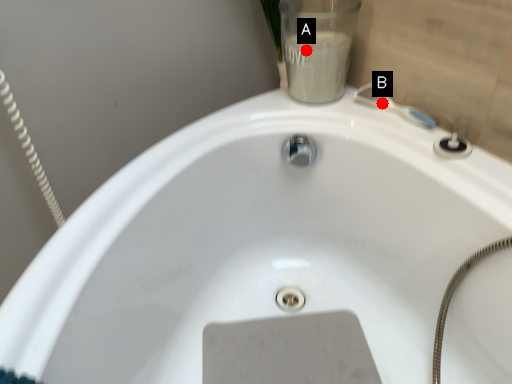
Question: Two points are circled on the image, labeled by A and B beside each circle. Which point is farther from the camera taking this photo?

Choices:
 (A) A is further
 (B) B is further

Answer: (B)